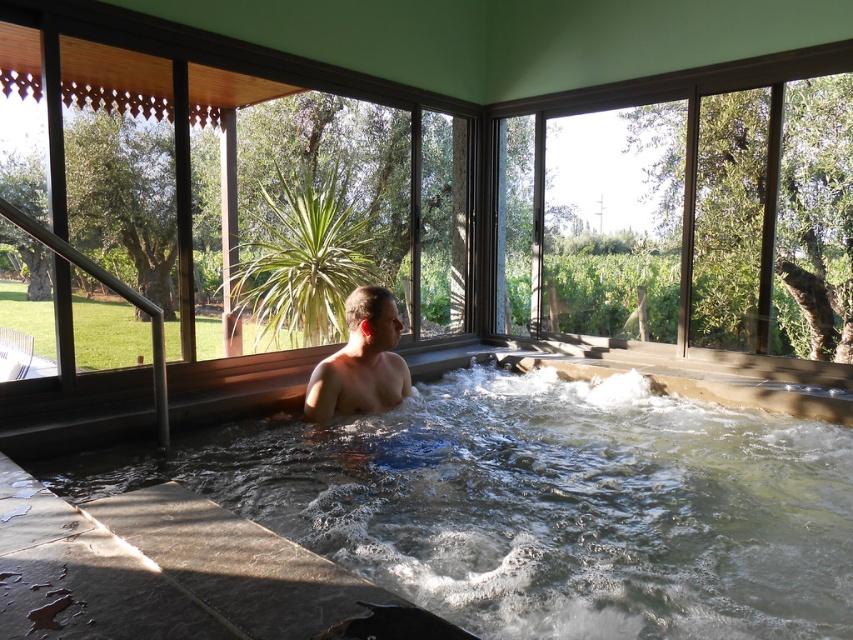
Is clear acrylic hot tub at center bigger than smooth skin man at center?

Yes.

Can you confirm if clear acrylic hot tub at center is smaller than smooth skin man at center?

No, clear acrylic hot tub at center is not smaller than smooth skin man at center.

Describe the element at coordinates (158, 570) in the screenshot. I see `clear acrylic hot tub at center` at that location.

Locate an element on the screen. The width and height of the screenshot is (853, 640). clear acrylic hot tub at center is located at coordinates (158, 570).